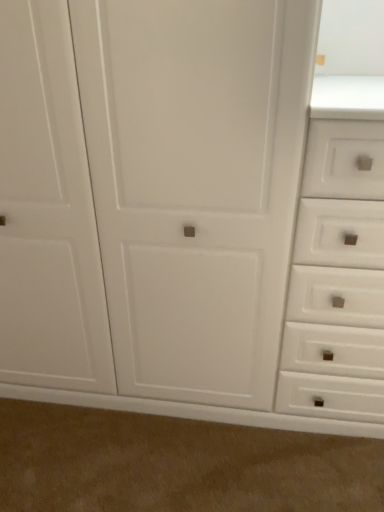
The height and width of the screenshot is (512, 384). What do you see at coordinates (337, 278) in the screenshot?
I see `white matte drawer at right` at bounding box center [337, 278].

Identify the location of white matte drawer at right. (337, 278).

Measure the distance between point (358,337) and camera.

Point (358,337) is 4.55 feet away from camera.

What is the approximate height of white matte drawer at right?

white matte drawer at right is 1.16 meters tall.

What do you see at coordinates (176, 464) in the screenshot? I see `beige carpet at lower center` at bounding box center [176, 464].

Where is `beige carpet at lower center`? The image size is (384, 512). beige carpet at lower center is located at coordinates (176, 464).

Measure the distance between beige carpet at lower center and camera.

beige carpet at lower center is 4.42 feet away from camera.

You are a GUI agent. You are given a task and a screenshot of the screen. Output one action in this format:
    pyautogui.click(x=<x>, y=<y>)
    Task: Click on the white matte drawer at right
    Image resolution: width=384 pixels, height=512 pixels.
    Given the screenshot: What is the action you would take?
    pyautogui.click(x=337, y=278)

Between beige carpet at lower center and white matte drawer at right, which one appears on the left side from the viewer's perspective?

beige carpet at lower center is more to the left.

Based on the photo, between beige carpet at lower center and white matte drawer at right, which one is positioned in front?

white matte drawer at right is more forward.

Is point (313, 459) behind point (338, 347)?

Yes, point (313, 459) is behind point (338, 347).

From the image's perspective, which is below, beige carpet at lower center or white matte drawer at right?

beige carpet at lower center, from the image's perspective.

From a real-world perspective, is beige carpet at lower center over white matte drawer at right?

No, from a real-world perspective, beige carpet at lower center is not above white matte drawer at right.

Which of these two, beige carpet at lower center or white matte drawer at right, is wider?

Wider between the two is white matte drawer at right.

Does beige carpet at lower center have a lesser height compared to white matte drawer at right?

Yes, beige carpet at lower center is shorter than white matte drawer at right.

Can you confirm if beige carpet at lower center is smaller than white matte drawer at right?

Yes.

Based on the photo, is beige carpet at lower center outside of white matte drawer at right?

Yes, beige carpet at lower center is located beyond the bounds of white matte drawer at right.

Is beige carpet at lower center far away from white matte drawer at right?

That's not correct — beige carpet at lower center is a little close to white matte drawer at right.

Is beige carpet at lower center aimed at white matte drawer at right?

No, beige carpet at lower center is not oriented towards white matte drawer at right.

Find the location of a particular element. drawer that appears on the right of beige carpet at lower center is located at coordinates (337, 278).

Between white matte drawer at right and beige carpet at lower center, which one appears on the right side from the viewer's perspective?

white matte drawer at right is more to the right.

Which is in front, white matte drawer at right or beige carpet at lower center?

white matte drawer at right is closer to the camera.

Considering the points (319, 197) and (254, 498), which point is behind, point (319, 197) or point (254, 498)?

The point (254, 498) is behind.

From the image's perspective, which is below, white matte drawer at right or beige carpet at lower center?

From the image's view, beige carpet at lower center is below.

From a real-world perspective, is white matte drawer at right physically located above or below beige carpet at lower center?

Clearly, from a real-world perspective, white matte drawer at right is above beige carpet at lower center.

Which object is thinner, white matte drawer at right or beige carpet at lower center?

With smaller width is beige carpet at lower center.

From the picture: Which of these two, white matte drawer at right or beige carpet at lower center, stands taller?

With more height is white matte drawer at right.

Which of these two, white matte drawer at right or beige carpet at lower center, is bigger?

white matte drawer at right is bigger.

Is white matte drawer at right situated inside beige carpet at lower center or outside?

white matte drawer at right is not inside beige carpet at lower center, it's outside.

Is white matte drawer at right far away from beige carpet at lower center?

They are positioned close to each other.

Could you tell me if white matte drawer at right is turned towards beige carpet at lower center?

No, white matte drawer at right does not turn towards beige carpet at lower center.

How different are the orientations of white matte drawer at right and beige carpet at lower center in degrees?

white matte drawer at right and beige carpet at lower center are facing 0.000806 degrees away from each other.

Find the location of `drawer lying in front of the beige carpet at lower center`. drawer lying in front of the beige carpet at lower center is located at coordinates (337, 278).

Identify the location of plain on the left side of white matte drawer at right. pyautogui.click(x=176, y=464).

Identify the location of plain below the white matte drawer at right (from a real-world perspective). (176, 464).